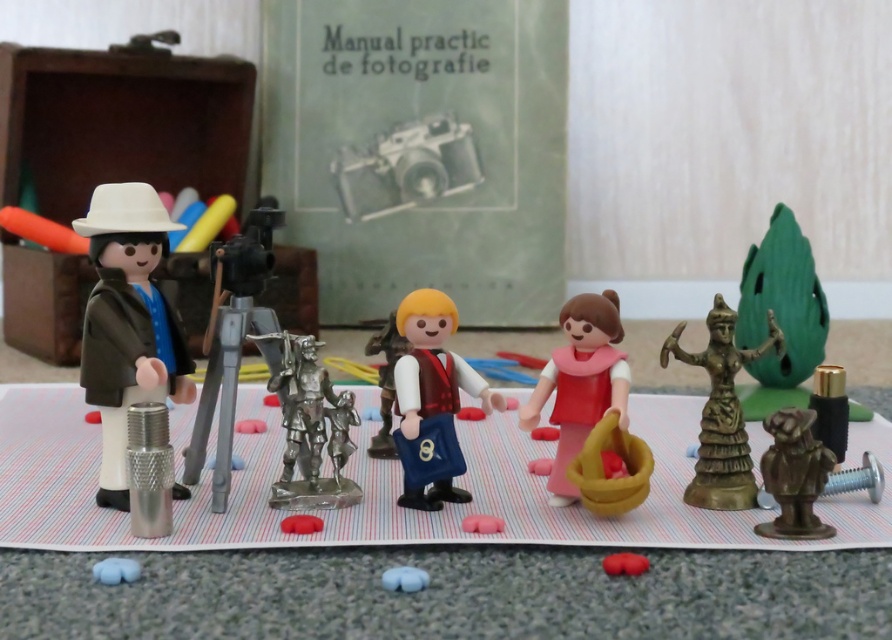
Does pink matte doll at center have a greater width compared to blue rubber toy at lower left?

Yes, pink matte doll at center is wider than blue rubber toy at lower left.

Is point (595, 340) positioned in front of point (120, 563)?

No, it is not.

At what (x,y) coordinates should I click in order to perform the action: click on pink matte doll at center. Please return your answer as a coordinate pair (x, y). Looking at the image, I should click on (580, 381).

Between metallic tripod at center and blue rubber toy at lower left, which one is positioned lower?

blue rubber toy at lower left

Can you confirm if metallic tripod at center is positioned below blue rubber toy at lower left?

Actually, metallic tripod at center is above blue rubber toy at lower left.

Is point (227, 392) behind point (131, 572)?

That is True.

Locate an element on the screen. metallic tripod at center is located at coordinates (230, 339).

How much distance is there between pink matte doll at center and matte silver camera at center?

3.34 feet

Consider the image. Which is more to the right, pink matte doll at center or matte silver camera at center?

Positioned to the right is pink matte doll at center.

The height and width of the screenshot is (640, 892). In order to click on pink matte doll at center in this screenshot , I will do `click(580, 381)`.

Locate an element on the screen. The image size is (892, 640). pink matte doll at center is located at coordinates (580, 381).